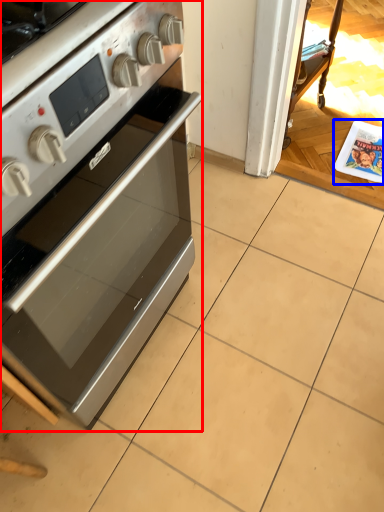
Question: Which of the following is the closest to the observer, home appliance (highlighted by a red box) or magazine (highlighted by a blue box)?

Choices:
 (A) home appliance
 (B) magazine

Answer: (A)